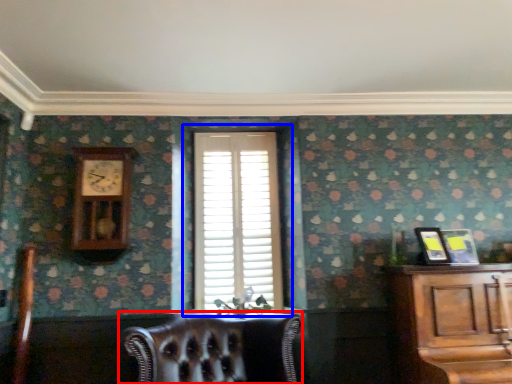
Question: Among these objects, which one is nearest to the camera, chair (highlighted by a red box) or window (highlighted by a blue box)?

Choices:
 (A) chair
 (B) window

Answer: (A)